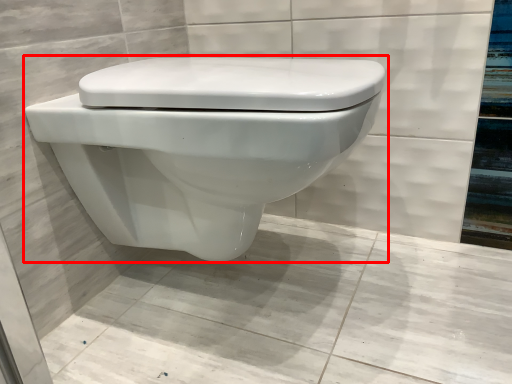
Question: From the image's perspective, considering the relative positions of toilet (annotated by the red box) and concrete in the image provided, where is toilet (annotated by the red box) located with respect to the staircase?

Choices:
 (A) below
 (B) above

Answer: (B)